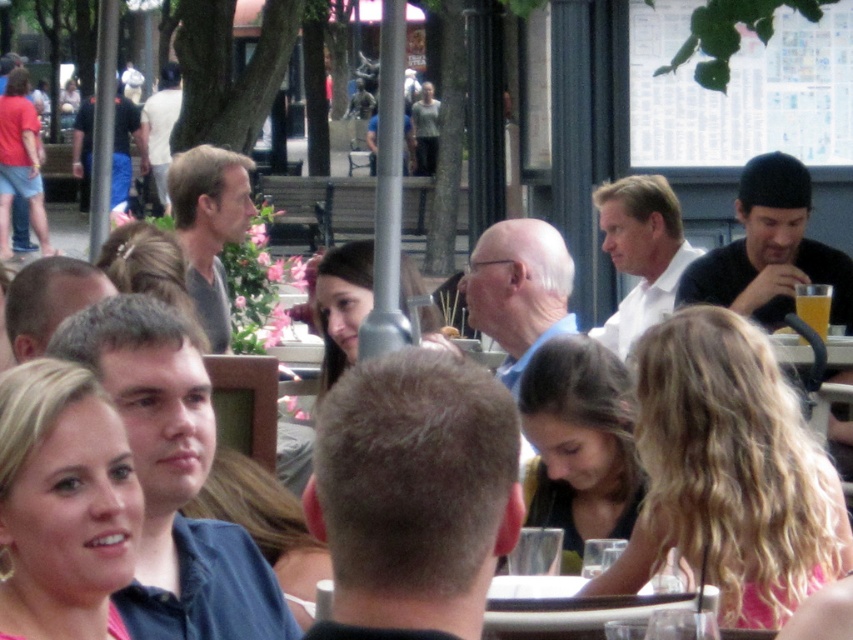
Which is more to the right, dark brown hair at center or translucent glass beverage at upper right?

From the viewer's perspective, translucent glass beverage at upper right appears more on the right side.

The width and height of the screenshot is (853, 640). Identify the location of dark brown hair at center. (579, 444).

Which is in front, point (764, 372) or point (799, 305)?

Point (764, 372)

Can you confirm if blonde curly hair at center is shorter than translucent glass beverage at upper right?

No.

Between point (653, 340) and point (795, 301), which one is positioned behind?

Point (795, 301)

Where is `blonde curly hair at center`? The image size is (853, 640). blonde curly hair at center is located at coordinates (728, 472).

Is blonde hair at center smaller than metallic silver table at center?

Incorrect, blonde hair at center is not smaller in size than metallic silver table at center.

Which is behind, point (80, 586) or point (534, 614)?

The point (534, 614) is behind.

Locate an element on the screen. blonde hair at center is located at coordinates (62, 504).